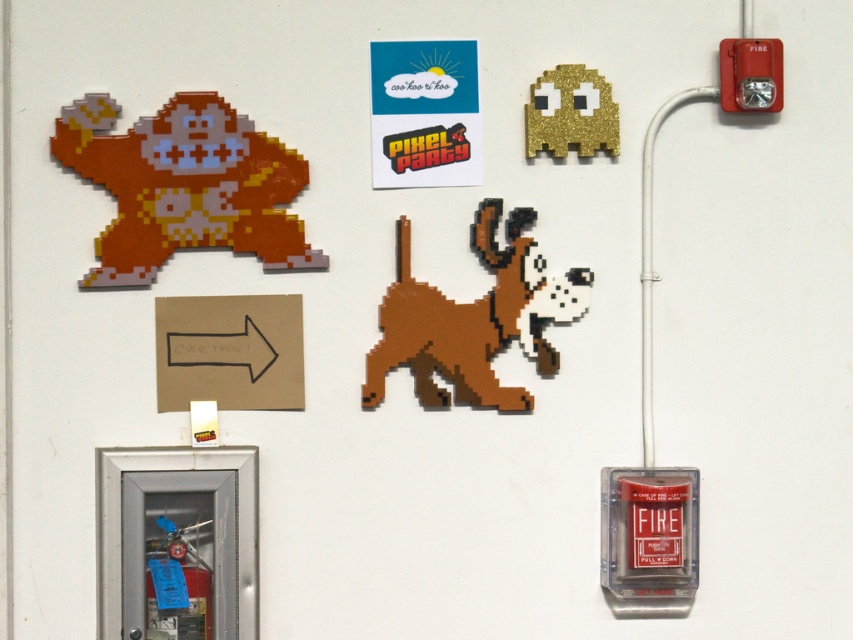
Which is more to the right, matte orange pixelated monkey at upper left or brown matte reindeer at center?

From the viewer's perspective, brown matte reindeer at center appears more on the right side.

Can you confirm if matte orange pixelated monkey at upper left is positioned below brown matte reindeer at center?

Actually, matte orange pixelated monkey at upper left is above brown matte reindeer at center.

Describe the element at coordinates (184, 186) in the screenshot. The height and width of the screenshot is (640, 853). I see `matte orange pixelated monkey at upper left` at that location.

What are the coordinates of `matte orange pixelated monkey at upper left` in the screenshot? It's located at (184, 186).

Describe the element at coordinates (184, 186) in the screenshot. Image resolution: width=853 pixels, height=640 pixels. I see `matte orange pixelated monkey at upper left` at that location.

Is matte orange pixelated monkey at upper left thinner than gold glitter ghost at upper center?

In fact, matte orange pixelated monkey at upper left might be wider than gold glitter ghost at upper center.

Is point (268, 237) positioned behind point (572, 138)?

No.

You are a GUI agent. You are given a task and a screenshot of the screen. Output one action in this format:
    pyautogui.click(x=<x>, y=<y>)
    Task: Click on the matte orange pixelated monkey at upper left
    
    Given the screenshot: What is the action you would take?
    pyautogui.click(x=184, y=186)

Is brown matte reindeer at center bigger than gold glitter ghost at upper center?

Indeed, brown matte reindeer at center has a larger size compared to gold glitter ghost at upper center.

Does brown matte reindeer at center appear on the left side of gold glitter ghost at upper center?

Correct, you'll find brown matte reindeer at center to the left of gold glitter ghost at upper center.

Is point (367, 362) positioned in front of point (553, 113)?

Yes, it is.

Identify the location of brown matte reindeer at center. (454, 321).